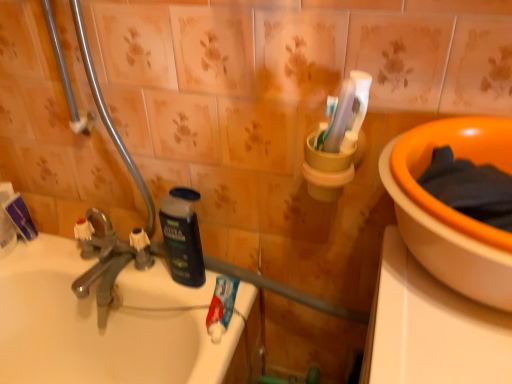
Question: From the image's perspective, would you say white matte toothpaste at upper left, the first toothpaste when ordered from back to front, is positioned over black matte bottle at center?

Choices:
 (A) yes
 (B) no

Answer: (A)

Question: Would you consider white matte toothpaste at upper left, which is counted as the 2th toothpaste, starting from the right, to be distant from black matte bottle at center?

Choices:
 (A) no
 (B) yes

Answer: (A)

Question: From the image's perspective, is white matte toothpaste at upper left, which is the second toothpaste from bottom to top, beneath black matte bottle at center?

Choices:
 (A) no
 (B) yes

Answer: (A)

Question: From a real-world perspective, is white matte toothpaste at upper left, which ranks as the second toothpaste in front-to-back order, positioned over black matte bottle at center based on gravity?

Choices:
 (A) no
 (B) yes

Answer: (A)

Question: Considering the relative sizes of white matte toothpaste at upper left, the first toothpaste when ordered from back to front, and black matte bottle at center in the image provided, is white matte toothpaste at upper left, the first toothpaste when ordered from back to front, thinner than black matte bottle at center?

Choices:
 (A) yes
 (B) no

Answer: (A)

Question: From the image's perspective, relative to chrome metallic faucet at left, is blue matte toothpaste at sink, positioned as the second toothpaste in top-to-bottom order, above or below?

Choices:
 (A) below
 (B) above

Answer: (A)

Question: Is blue matte toothpaste at sink, the 2th toothpaste when ordered from back to front, wider or thinner than chrome metallic faucet at left?

Choices:
 (A) wide
 (B) thin

Answer: (B)

Question: Would you say blue matte toothpaste at sink, which ranks as the first toothpaste in front-to-back order, is to the left or to the right of chrome metallic faucet at left in the picture?

Choices:
 (A) left
 (B) right

Answer: (B)

Question: Choose the correct answer: Is blue matte toothpaste at sink, the 1th toothpaste positioned from the bottom, inside chrome metallic faucet at left or outside it?

Choices:
 (A) outside
 (B) inside

Answer: (A)

Question: Based on their sizes in the image, would you say chrome metallic faucet at left is bigger or smaller than white matte toothpaste at upper left, the first toothpaste when ordered from back to front?

Choices:
 (A) small
 (B) big

Answer: (B)

Question: In terms of height, does chrome metallic faucet at left look taller or shorter compared to white matte toothpaste at upper left, which is counted as the first toothpaste, starting from the left?

Choices:
 (A) tall
 (B) short

Answer: (A)

Question: Is point (x=117, y=263) positioned closer to the camera than point (x=6, y=200)?

Choices:
 (A) closer
 (B) farther

Answer: (A)

Question: Is chrome metallic faucet at left situated inside white matte toothpaste at upper left, the first toothpaste when ordered from back to front, or outside?

Choices:
 (A) outside
 (B) inside

Answer: (A)

Question: From a real-world perspective, is blue matte toothpaste at sink, positioned as the second toothpaste in top-to-bottom order, positioned above or below white matte toothpaste at upper left, which is counted as the 2th toothpaste, starting from the right?

Choices:
 (A) above
 (B) below

Answer: (B)

Question: Is blue matte toothpaste at sink, which ranks as the first toothpaste in right-to-left order, wider or thinner than white matte toothpaste at upper left, the first toothpaste when ordered from back to front?

Choices:
 (A) thin
 (B) wide

Answer: (B)